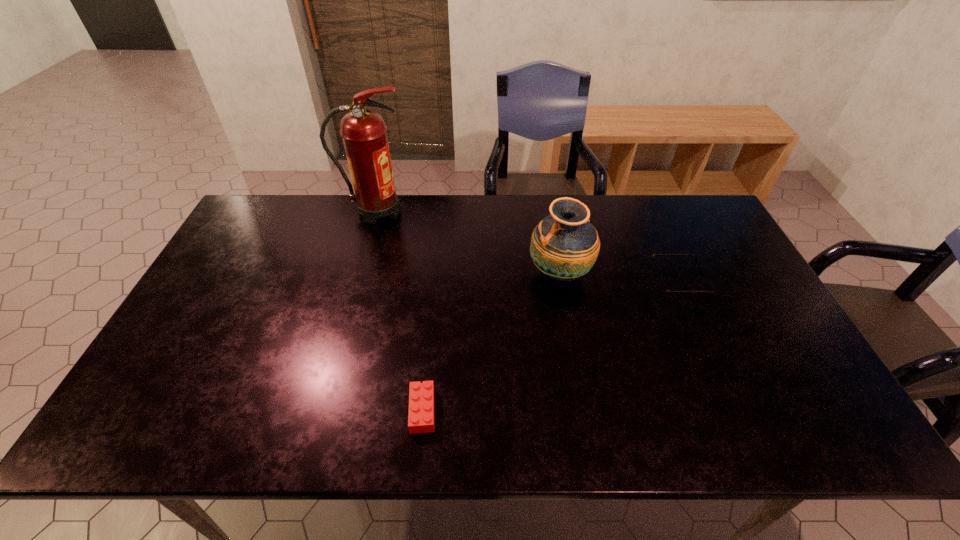
At what (x,y) coordinates should I click in order to perform the action: click on free location located 0.140m at the hinge ends of the third tallest object. Please return your answer as a coordinate pair (x, y). The height and width of the screenshot is (540, 960). Looking at the image, I should click on (605, 284).

Image resolution: width=960 pixels, height=540 pixels. Identify the location of vacant space located at the hinge ends of the third tallest object. (529, 284).

In order to click on vacant point located at the hinge ends of the third tallest object in this screenshot , I will do `click(557, 284)`.

This screenshot has width=960, height=540. Find the location of `free spot located 0.160m on the right of the shortest object`. free spot located 0.160m on the right of the shortest object is located at coordinates (506, 410).

Locate an element on the screen. The width and height of the screenshot is (960, 540). object that is at the far edge is located at coordinates 363,131.

Locate an element on the screen. object located at the near edge is located at coordinates (421, 417).

You are a GUI agent. You are given a task and a screenshot of the screen. Output one action in this format:
    pyautogui.click(x=<x>, y=<y>)
    Task: Click on the object that is at the right edge
    The width and height of the screenshot is (960, 540).
    Given the screenshot: What is the action you would take?
    pyautogui.click(x=663, y=291)

Locate an element on the screen. vacant space at the far edge is located at coordinates (608, 219).

You are a GUI agent. You are given a task and a screenshot of the screen. Output one action in this format:
    pyautogui.click(x=<x>, y=<y>)
    Task: Click on the vacant space at the near edge of the desktop
    This screenshot has width=960, height=540.
    Given the screenshot: What is the action you would take?
    click(717, 422)

In the image, there is a desktop. Where is `vacant region at the left edge`? This screenshot has width=960, height=540. vacant region at the left edge is located at coordinates (201, 304).